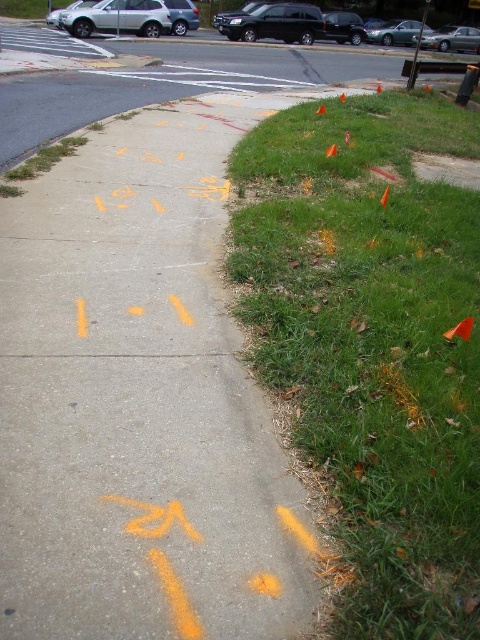
Consider the image. Does silver metallic suv at upper left appear on the left side of orange fabric traffic cone at upper center?

Yes, silver metallic suv at upper left is to the left of orange fabric traffic cone at upper center.

Does point (176, 35) come behind point (316, 109)?

Yes, it is behind point (316, 109).

Locate an element on the screen. The width and height of the screenshot is (480, 640). silver metallic suv at upper left is located at coordinates (181, 16).

Identify the location of silver metallic suv at upper left. (181, 16).

Who is lower down, shiny black suv at upper center or orange fabric traffic cone at upper center?

orange fabric traffic cone at upper center is lower down.

Is the position of shiny black suv at upper center more distant than that of orange fabric traffic cone at upper center?

Yes, shiny black suv at upper center is behind orange fabric traffic cone at upper center.

Describe the element at coordinates (289, 22) in the screenshot. I see `shiny black suv at upper center` at that location.

Where is `shiny black suv at upper center`? This screenshot has width=480, height=640. shiny black suv at upper center is located at coordinates (289, 22).

Between orange plastic traffic cone at lower right and orange plastic traffic cone at upper center, which one is positioned higher?

orange plastic traffic cone at upper center is higher up.

Identify the location of orange plastic traffic cone at lower right. The image size is (480, 640). (460, 330).